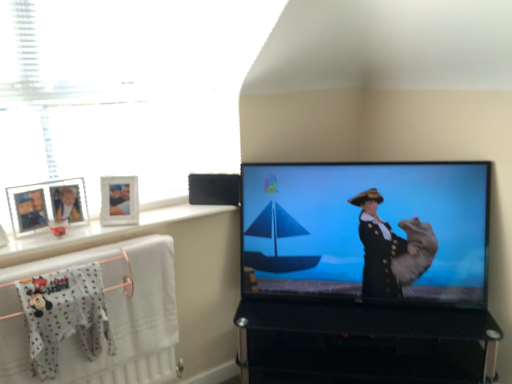
This screenshot has height=384, width=512. What do you see at coordinates (364, 343) in the screenshot?
I see `black glass tv stand at lower right` at bounding box center [364, 343].

What is the approximate height of white glossy window sill at upper left?

white glossy window sill at upper left is 1.23 inches in height.

Find the location of a particular element. Image resolution: width=512 pixels, height=384 pixels. black plastic speaker at upper center is located at coordinates (214, 189).

What is the approximate height of black plastic speaker at upper center?

The height of black plastic speaker at upper center is 15.49 centimeters.

What is the approximate width of white plastic picture frame at upper left?

white plastic picture frame at upper left is 1.68 inches wide.

Describe the element at coordinates (65, 315) in the screenshot. Image resolution: width=512 pixels, height=384 pixels. I see `white cotton onesie at lower left` at that location.

Where is `black glass tv stand at lower right`? The image size is (512, 384). black glass tv stand at lower right is located at coordinates (364, 343).

You are a GUI agent. You are given a task and a screenshot of the screen. Output one action in this format:
    pyautogui.click(x=<x>, y=<y>)
    Task: Click on the picture frame lying in front of the black glass tv stand at lower right
    This screenshot has width=512, height=384.
    Given the screenshot: What is the action you would take?
    pyautogui.click(x=47, y=205)

Is white plastic picture frame at upper left further to camera compared to black glass tv stand at lower right?

No.

Is black glass tv stand at lower right a part of white plastic picture frame at upper left?

No, black glass tv stand at lower right is located outside of white plastic picture frame at upper left.

From a real-world perspective, which object rests below the other?

black glass tv stand at lower right.

Considering the sizes of objects black glass tv stand at lower right and black plastic speaker at upper center in the image provided, who is smaller, black glass tv stand at lower right or black plastic speaker at upper center?

Smaller between the two is black plastic speaker at upper center.

Is black glass tv stand at lower right positioned beyond the bounds of black plastic speaker at upper center?

That's correct, black glass tv stand at lower right is outside of black plastic speaker at upper center.

From the image's perspective, is white textured towel at lower left over black glass tv stand at lower right?

Yes, from the image's perspective, white textured towel at lower left is over black glass tv stand at lower right.

Is black glass tv stand at lower right located within white textured towel at lower left?

No, white textured towel at lower left does not contain black glass tv stand at lower right.

Consider the image. From a real-world perspective, is white textured towel at lower left beneath black glass tv stand at lower right?

No.

Between point (112, 286) and point (386, 368), which one is positioned in front?

The point (112, 286) is closer to the camera.

Can we say white plastic picture frame at upper left lies outside white fabric hanger at lower left?

That's correct, white plastic picture frame at upper left is outside of white fabric hanger at lower left.

Based on the photo, considering the sizes of objects white plastic picture frame at upper left and white fabric hanger at lower left in the image provided, who is smaller, white plastic picture frame at upper left or white fabric hanger at lower left?

Smaller between the two is white plastic picture frame at upper left.

Consider the image. Is white plastic picture frame at upper left far away from white fabric hanger at lower left?

That's not correct — white plastic picture frame at upper left is a little close to white fabric hanger at lower left.

Which object is positioned more to the right, white plastic picture frame at upper left or white fabric hanger at lower left?

From the viewer's perspective, white fabric hanger at lower left appears more on the right side.

Is white cotton onesie at lower left looking in the opposite direction of white glossy window sill at upper left?

No, white cotton onesie at lower left's orientation is not away from white glossy window sill at upper left.

Can white glossy window sill at upper left be found inside white cotton onesie at lower left?

No, white glossy window sill at upper left is not surrounded by white cotton onesie at lower left.

Image resolution: width=512 pixels, height=384 pixels. Identify the location of baby clothe that appears below the white glossy window sill at upper left (from a real-world perspective). (65, 315).

Is matte black screen at right placed right next to white cotton onesie at lower left?

matte black screen at right is not next to white cotton onesie at lower left, and they're not touching.

Is matte black screen at right oriented towards white cotton onesie at lower left?

No, matte black screen at right is not aimed at white cotton onesie at lower left.

Find the location of a particular element. television behind the white cotton onesie at lower left is located at coordinates (367, 231).

Can you tell me how much matte black screen at right and white cotton onesie at lower left differ in facing direction?

The facing directions of matte black screen at right and white cotton onesie at lower left are 41 degrees apart.

From the image's perspective, relative to black plastic speaker at upper center, is white plastic picture frame at upper left above or below?

Clearly, from the image's perspective, white plastic picture frame at upper left is below black plastic speaker at upper center.

Identify the location of speaker behind the white plastic picture frame at upper left. (214, 189).

Is point (13, 227) behind point (196, 186)?

No, (13, 227) is in front of (196, 186).

Could you tell me if white plastic picture frame at upper left is turned towards black plastic speaker at upper center?

No, white plastic picture frame at upper left does not turn towards black plastic speaker at upper center.

Identify the location of picture frame located in front of the black glass tv stand at lower right. point(47,205).

Find the location of `furniture located below the black plastic speaker at upper center (from the image's perspective)`. furniture located below the black plastic speaker at upper center (from the image's perspective) is located at coordinates [x=364, y=343].

Considering their positions, is white plastic picture frame at upper left positioned closer to white textured towel at lower left than white cotton onesie at lower left?

white cotton onesie at lower left is closer to white textured towel at lower left.

Based on their spatial positions, is white textured towel at lower left or black glass tv stand at lower right closer to white cotton onesie at lower left?

white textured towel at lower left is closer to white cotton onesie at lower left.

Which object lies further to the anchor point white glossy window sill at upper left, black plastic speaker at upper center or matte black screen at right?

matte black screen at right lies further to white glossy window sill at upper left than the other object.

Based on their spatial positions, is black glass tv stand at lower right or white plastic picture frame at upper left further from black plastic speaker at upper center?

black glass tv stand at lower right lies further to black plastic speaker at upper center than the other object.

When comparing their distances from white cotton onesie at lower left, does black plastic speaker at upper center or black glass tv stand at lower right seem further?

black glass tv stand at lower right is positioned further to the anchor white cotton onesie at lower left.

From the image, which object appears to be nearer to matte black screen at right, white fabric hanger at lower left or white glossy window sill at upper left?

white glossy window sill at upper left is closer to matte black screen at right.

Considering their positions, is white textured towel at lower left positioned further to matte black screen at right than black glass tv stand at lower right?

white textured towel at lower left lies further to matte black screen at right than the other object.

Based on their spatial positions, is matte black screen at right or black plastic speaker at upper center further from white plastic picture frame at upper left?

The object further to white plastic picture frame at upper left is matte black screen at right.

Identify the location of bath towel between white cotton onesie at lower left and matte black screen at right. (94, 315).

Locate an element on the screen. The width and height of the screenshot is (512, 384). bath towel located between white fabric hanger at lower left and matte black screen at right in the left-right direction is located at coordinates (94, 315).

What are the coordinates of `baby clothe located between white fabric hanger at lower left and black glass tv stand at lower right in the left-right direction` in the screenshot? It's located at (65, 315).

Find the location of a particular element. television between black plastic speaker at upper center and black glass tv stand at lower right in the up-down direction is located at coordinates (367, 231).